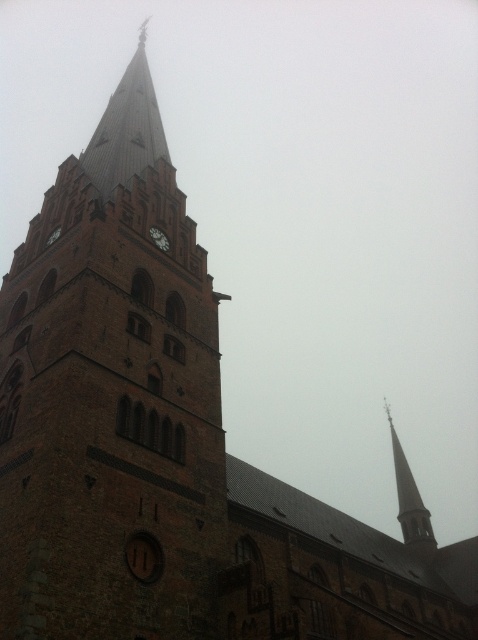
Question: Which point is closer to the camera?

Choices:
 (A) brown brick tower at center
 (B) matte brown clock at center

Answer: (A)

Question: Which point is closer to the camera?

Choices:
 (A) smooth gray spire at upper right
 (B) matte brown clock at center
 (C) brown brick tower at center

Answer: (C)

Question: Where is brown brick tower at center located in relation to matte brown clock at center in the image?

Choices:
 (A) right
 (B) left

Answer: (B)

Question: Which object is farther from the camera taking this photo?

Choices:
 (A) smooth gray spire at upper right
 (B) brown brick tower at center

Answer: (A)

Question: Does brown brick tower at center have a smaller size compared to smooth gray spire at upper right?

Choices:
 (A) no
 (B) yes

Answer: (B)

Question: Does brown brick tower at center have a larger size compared to matte brown clock at center?

Choices:
 (A) no
 (B) yes

Answer: (B)